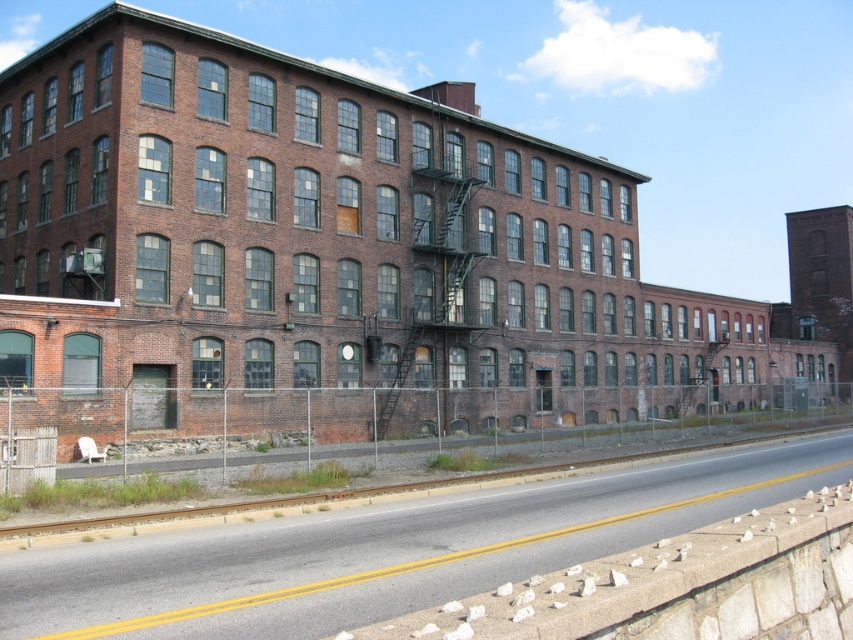
Question: Considering the relative positions of brick building at center and smooth asphalt train track at lower center in the image provided, where is brick building at center located with respect to smooth asphalt train track at lower center?

Choices:
 (A) above
 (B) below

Answer: (A)

Question: Among these points, which one is farthest from the camera?

Choices:
 (A) (233, 412)
 (B) (524, 499)

Answer: (A)

Question: Can you confirm if brick building at center is wider than smooth asphalt train track at lower center?

Choices:
 (A) no
 (B) yes

Answer: (B)

Question: Which point appears closest to the camera in this image?

Choices:
 (A) (183, 280)
 (B) (302, 561)

Answer: (B)

Question: Which object is closer to the camera taking this photo?

Choices:
 (A) smooth asphalt train track at lower center
 (B) brick building at center

Answer: (A)

Question: Does brick building at center have a larger size compared to smooth asphalt train track at lower center?

Choices:
 (A) no
 (B) yes

Answer: (B)